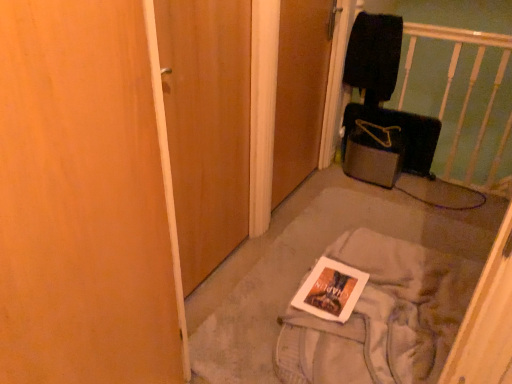
Identify the location of free space that is in between white fabric book at center and velvet black suitcase at right. The height and width of the screenshot is (384, 512). (390, 201).